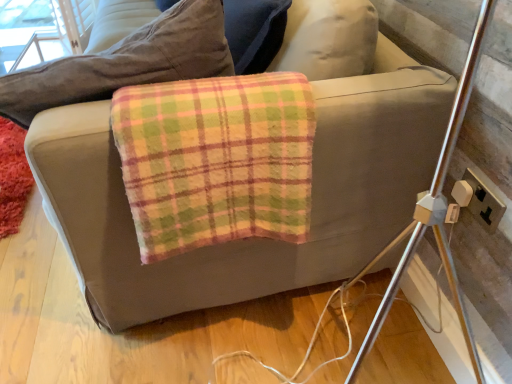
Question: Considering the positions of plaid fleece blanket at center and gold plastic electrical outlet at right in the image, is plaid fleece blanket at center taller or shorter than gold plastic electrical outlet at right?

Choices:
 (A) short
 (B) tall

Answer: (B)

Question: In terms of width, does plaid fleece blanket at center look wider or thinner when compared to gold plastic electrical outlet at right?

Choices:
 (A) thin
 (B) wide

Answer: (B)

Question: Which is nearer to the gold plastic electrical outlet at right?

Choices:
 (A) fluffy red mat at lower left
 (B) plaid fleece blanket at center

Answer: (B)

Question: Which object is the farthest from the gold plastic electrical outlet at right?

Choices:
 (A) fluffy red mat at lower left
 (B) plaid fleece blanket at center

Answer: (A)